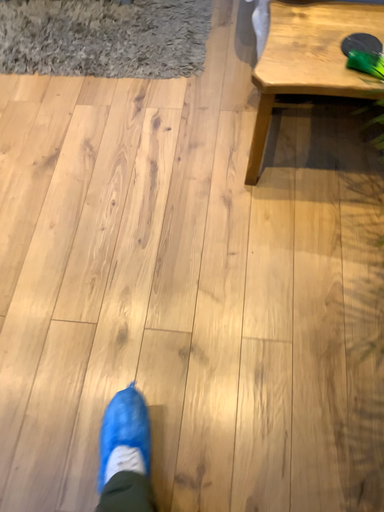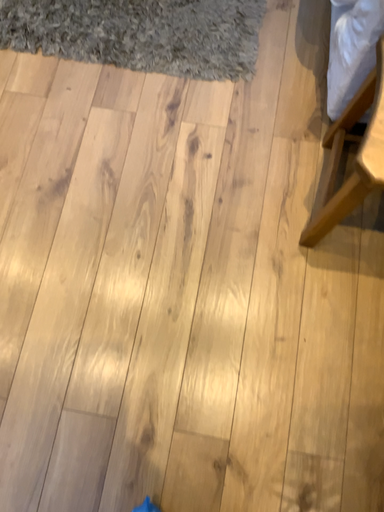
Question: Which way did the camera rotate in the video?

Choices:
 (A) rotated upward
 (B) rotated downward

Answer: (B)